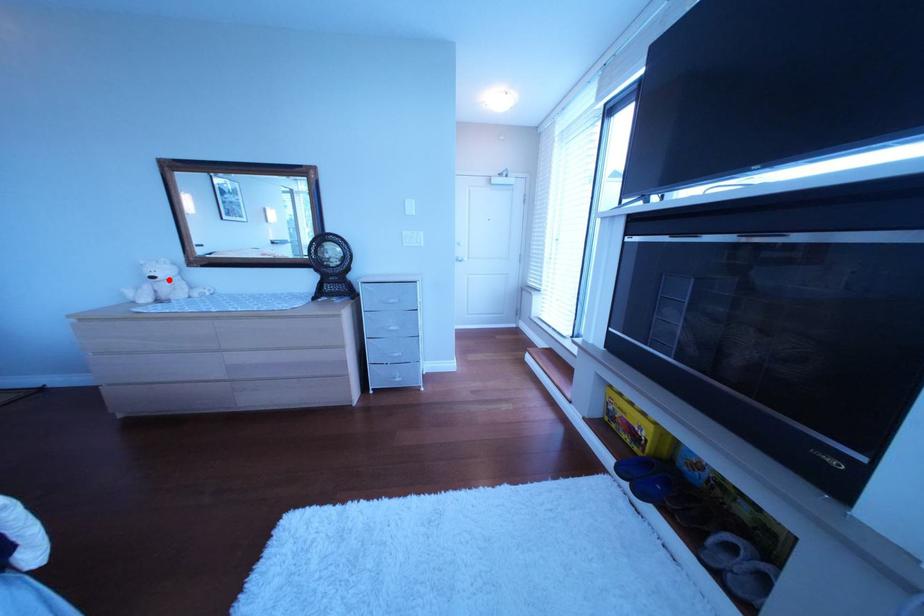
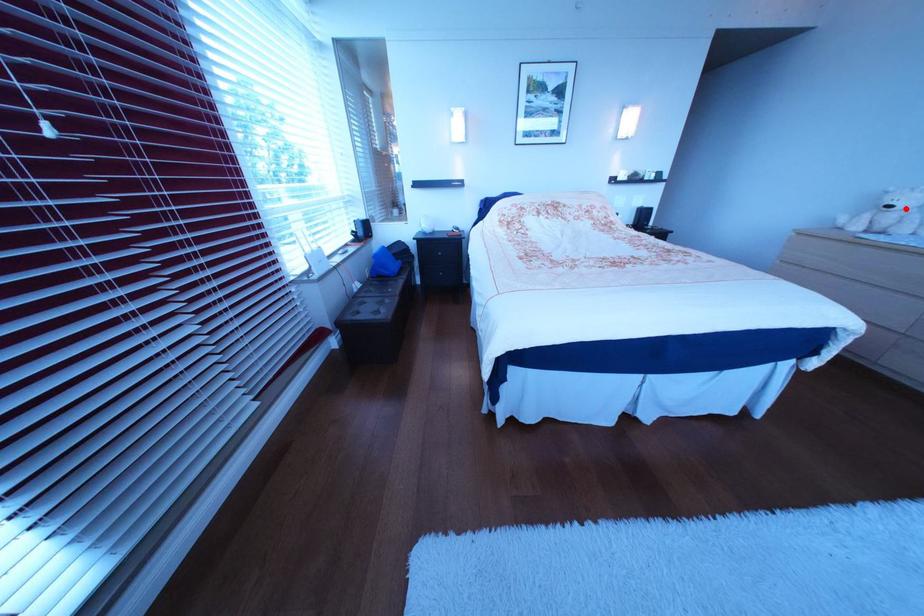
I am providing you with two images of the same scene from different viewpoints. A red point is marked on the first image and another point is marked on the second image. Do the highlighted points in image1 and image2 indicate the same real-world spot?

Yes